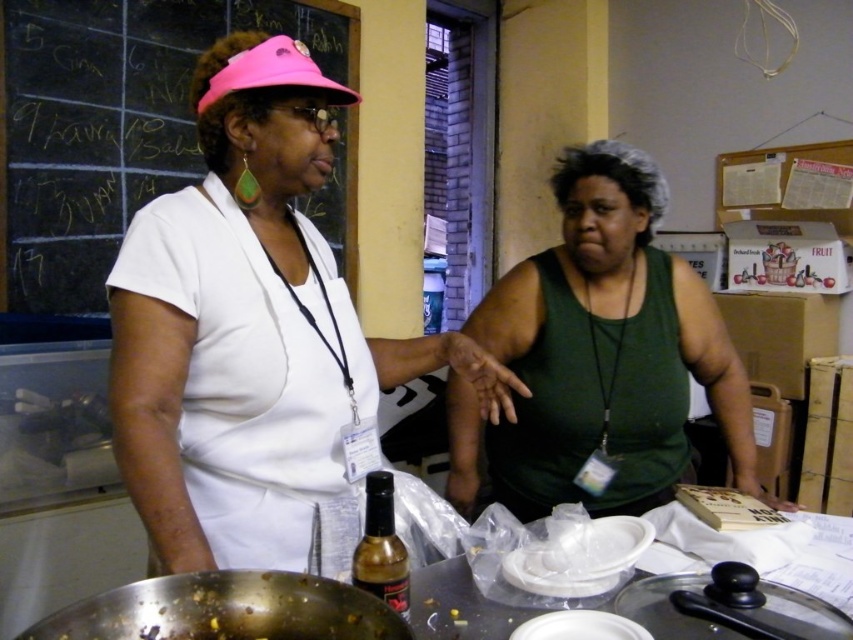
Which is below, green matte tank top at center or shiny brown glass bottle at center?

Positioned lower is shiny brown glass bottle at center.

Is green matte tank top at center taller than shiny brown glass bottle at center?

Yes.

Is point (646, 241) closer to camera compared to point (386, 484)?

No.

Locate an element on the screen. The width and height of the screenshot is (853, 640). green matte tank top at center is located at coordinates (608, 348).

Which of these two, white matte apron at center or green matte tank top at center, stands taller?

With more height is white matte apron at center.

Between point (399, 368) and point (677, 381), which one is positioned behind?

Positioned behind is point (677, 381).

Where is `white matte apron at center`? This screenshot has width=853, height=640. white matte apron at center is located at coordinates (252, 330).

Is chalkboard at upper left behind pink fabric visor at upper center?

Yes, it is.

Image resolution: width=853 pixels, height=640 pixels. Identify the location of chalkboard at upper left. (114, 124).

Is point (61, 260) positioned after point (343, 99)?

Yes, point (61, 260) is farther from viewer.

I want to click on chalkboard at upper left, so click(x=114, y=124).